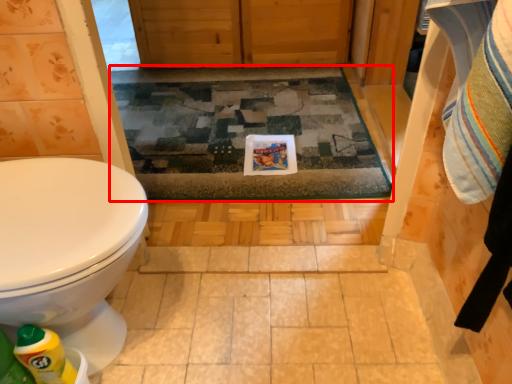
Question: From the image's perspective, what is the correct spatial positioning of bath mat (annotated by the red box) in reference to cleaning product?

Choices:
 (A) below
 (B) above

Answer: (B)